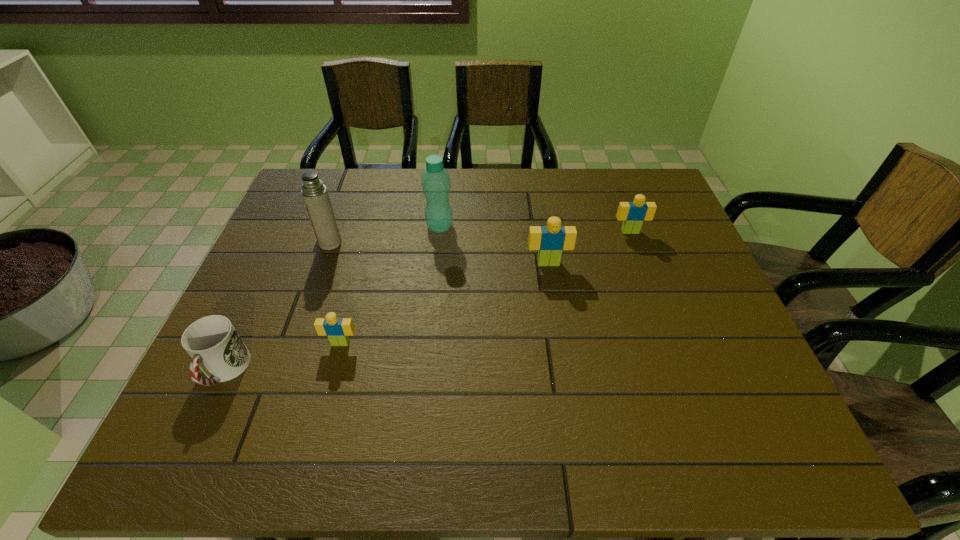
To ensure equal spacing by inserting another Lego among them, please point out a vacant spot for this new Lego. Please provide its 2D coordinates. Your answer should be formatted as a tuple, i.e. [(x, y)], where the tuple contains the x and y coordinates of a point satisfying the conditions above.

[(453, 300)]